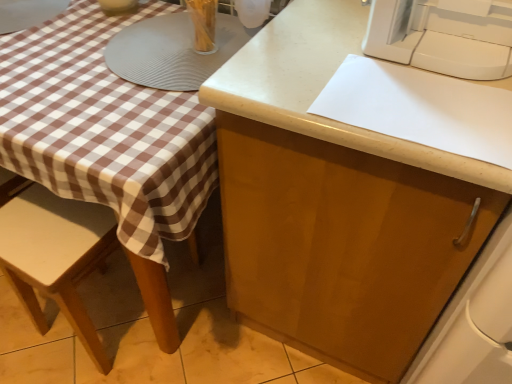
The image size is (512, 384). What are the coordinates of `blank space situated above matte wood cabinet at center (from a real-world perspective)` in the screenshot? It's located at (386, 74).